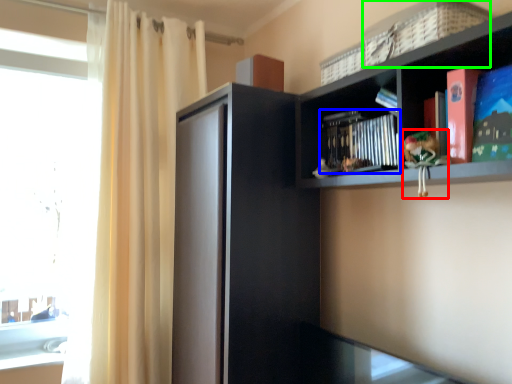
Question: Which object is the closest to the toy (highlighted by a red box)? Choose among these: book (highlighted by a blue box) or basket (highlighted by a green box).

Choices:
 (A) book
 (B) basket

Answer: (A)